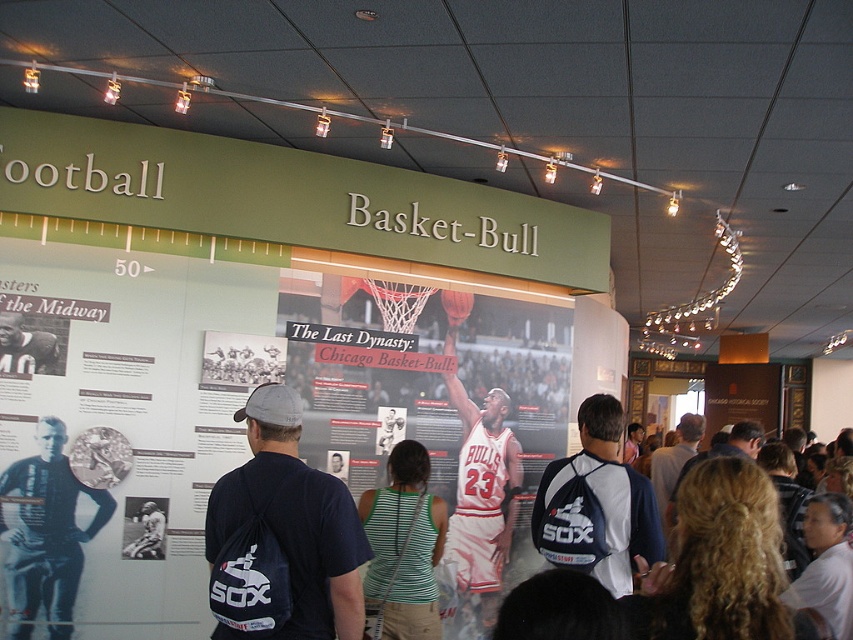
You are a museum visitor who wants to compare the basketballs displayed in the exhibit. Which basketball, the white jersey basketball at center or the white matte basketball at center, is wider?

The white jersey basketball at center is wider than the white matte basketball at center because its width surpasses the other.

You are a museum visitor standing in the exhibit space. You see the matte basketball jersey at center and the white shirt at center. If you want to take a photo of both items in the same frame, would you need to zoom out or zoom in your camera?

The distance between the matte basketball jersey at center and the white shirt at center is 2.96 meters. To capture both items in the same frame, you would need to zoom out your camera to widen the field of view and include both objects separated by that distance.